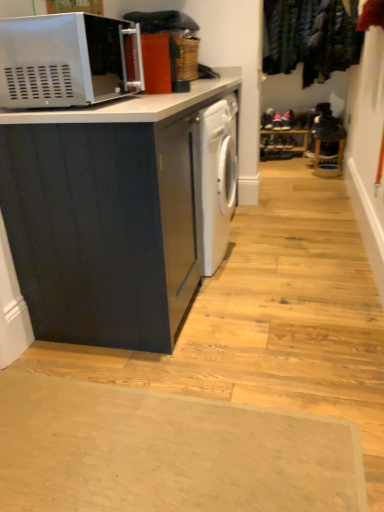
Find the location of `vacant space in front of matte black cabinet at left`. vacant space in front of matte black cabinet at left is located at coordinates pyautogui.click(x=214, y=381).